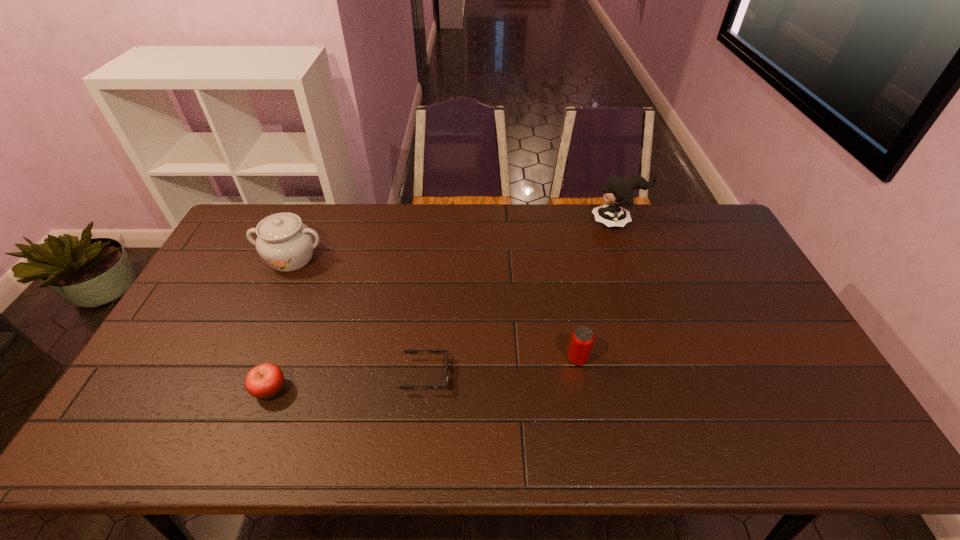
Identify the location of free spot located at the face of the rightmost object. [x=550, y=222].

Find the location of a particular element. This screenshot has height=540, width=960. blank space located 0.290m at the face of the rightmost object is located at coordinates pos(513,222).

Identify the location of free space located 0.120m on the back of the fourth shortest object. (308, 220).

In order to click on vacant region located 0.270m on the back of the third tallest object in this screenshot , I will do `click(563, 280)`.

Locate an element on the screen. vacant space located on the back of the apple is located at coordinates (306, 294).

The height and width of the screenshot is (540, 960). What are the coordinates of `free space located on the temples of the shortest object` in the screenshot? It's located at (567, 374).

Where is `doll positioned at the far edge`? Image resolution: width=960 pixels, height=540 pixels. doll positioned at the far edge is located at coordinates (618, 192).

Where is `chinaware that is at the far edge`? The height and width of the screenshot is (540, 960). chinaware that is at the far edge is located at coordinates (286, 244).

Where is `object at the left edge`? Image resolution: width=960 pixels, height=540 pixels. object at the left edge is located at coordinates (286, 244).

This screenshot has height=540, width=960. Find the location of `object that is at the far left corner`. object that is at the far left corner is located at coordinates (286, 244).